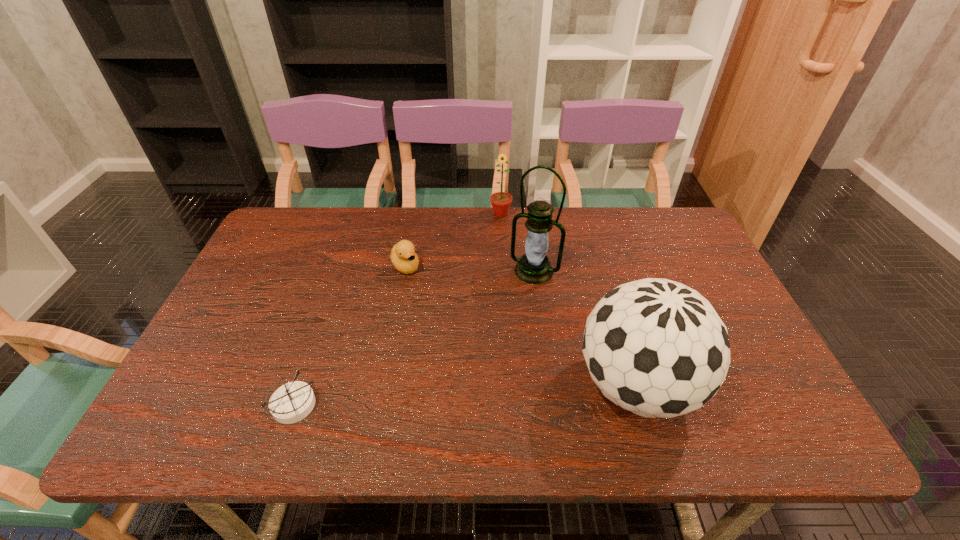
I want to click on compass, so click(292, 402).

The image size is (960, 540). I want to click on the leftmost object, so click(292, 402).

Locate an element on the screen. The width and height of the screenshot is (960, 540). soccer ball is located at coordinates (657, 348).

At what (x,y) coordinates should I click in order to perform the action: click on sunflower. Please return your answer as a coordinate pair (x, y). This screenshot has height=540, width=960. Looking at the image, I should click on (501, 201).

This screenshot has width=960, height=540. In order to click on the farthest object in this screenshot , I will do `click(501, 201)`.

Locate an element on the screen. Image resolution: width=960 pixels, height=540 pixels. the second shortest object is located at coordinates (405, 260).

The height and width of the screenshot is (540, 960). In order to click on the fourth object from right to left in this screenshot , I will do `click(405, 260)`.

I want to click on lantern, so click(x=534, y=267).

Locate an element on the screen. The image size is (960, 540). vacant space located 0.210m on the back of the shortest object is located at coordinates (324, 316).

This screenshot has width=960, height=540. Identify the location of vacant space located on the back of the second tallest object. (600, 264).